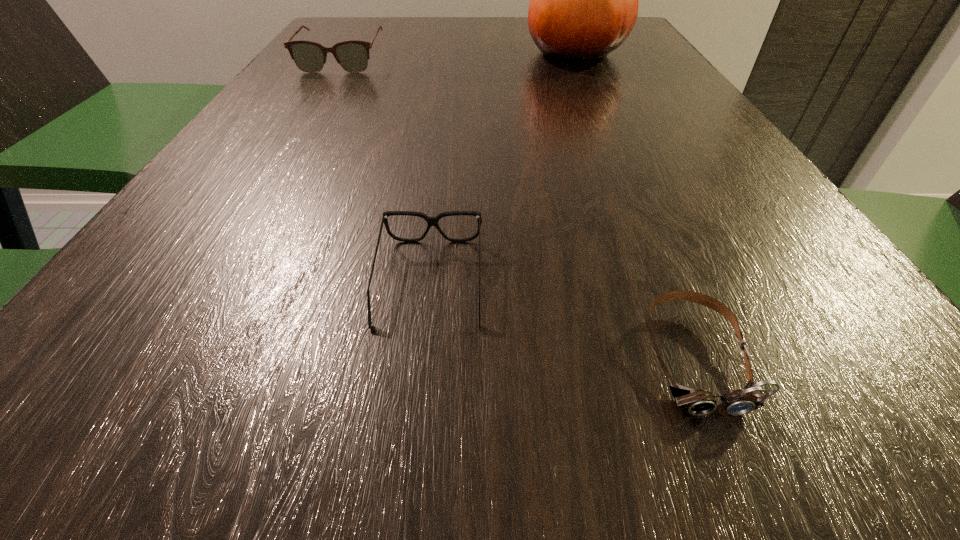
Locate an element on the screen. The image size is (960, 540). pumpkin is located at coordinates (584, 0).

Locate an element on the screen. the farther spectacles is located at coordinates (352, 55).

Locate an element on the screen. the leftmost object is located at coordinates (352, 55).

Locate an element on the screen. This screenshot has width=960, height=540. the right spectacles is located at coordinates (431, 221).

I want to click on the nearer spectacles, so click(431, 221).

In order to click on the shortest object in this screenshot , I will do `click(698, 402)`.

Where is `free region located on the left of the tallest object`? The image size is (960, 540). free region located on the left of the tallest object is located at coordinates (419, 52).

At what (x,y) coordinates should I click in order to perform the action: click on vacant space situated 0.120m at the front view of the third shortest object. Please return your answer as a coordinate pair (x, y). The width and height of the screenshot is (960, 540). Looking at the image, I should click on (320, 97).

In order to click on free space located 0.140m with the lenses facing outward on the right spectacles in this screenshot , I will do `click(409, 469)`.

Where is `object located at the far edge`? The height and width of the screenshot is (540, 960). object located at the far edge is located at coordinates point(584,0).